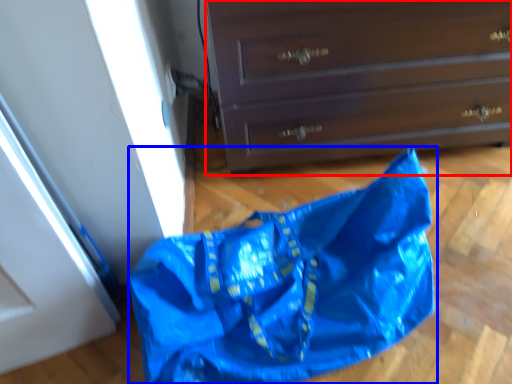
Question: Among these objects, which one is farthest to the camera, chest of drawers (highlighted by a red box) or grocery bag (highlighted by a blue box)?

Choices:
 (A) chest of drawers
 (B) grocery bag

Answer: (A)